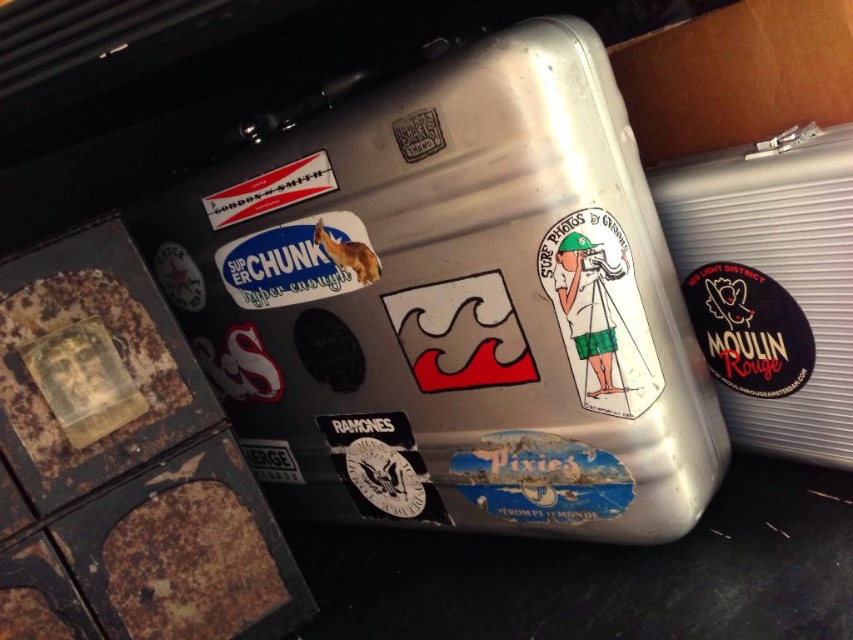
Question: Among these points, which one is farthest from the camera?

Choices:
 (A) (236, 266)
 (B) (227, 218)
 (C) (804, 284)

Answer: (A)

Question: Is silver metallic cooler at right wider than white matte sticker at upper left?

Choices:
 (A) no
 (B) yes

Answer: (B)

Question: Among these points, which one is farthest from the camera?

Choices:
 (A) (300, 160)
 (B) (780, 294)

Answer: (A)

Question: Can you confirm if brushed metal cooler at center is positioned below silver metallic cooler at right?

Choices:
 (A) yes
 (B) no

Answer: (A)

Question: Can you confirm if silver metallic cooler at right is wider than white matte sticker at upper left?

Choices:
 (A) no
 (B) yes

Answer: (B)

Question: Among these points, which one is farthest from the camera?

Choices:
 (A) (786, 330)
 (B) (685, 289)

Answer: (B)